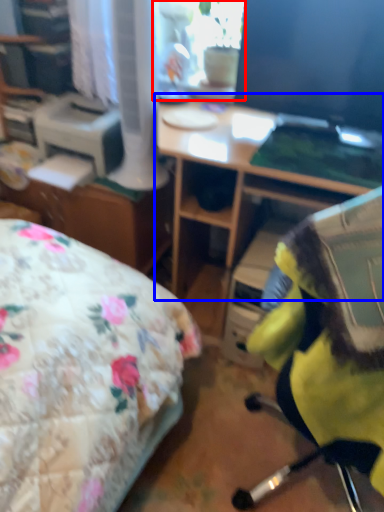
Question: Which of the following is the closest to the observer, window screen (highlighted by a red box) or desk (highlighted by a blue box)?

Choices:
 (A) window screen
 (B) desk

Answer: (B)